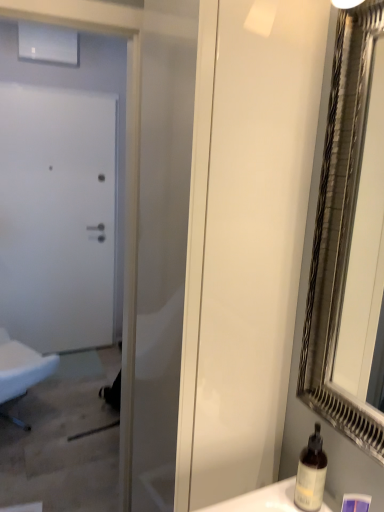
Question: Is translucent glass bottle at lower right inside the boundaries of white fabric chair at left, or outside?

Choices:
 (A) inside
 (B) outside

Answer: (B)

Question: From a real-world perspective, relative to white fabric chair at left, is translucent glass bottle at lower right vertically above or below?

Choices:
 (A) above
 (B) below

Answer: (A)

Question: Considering the real-world distances, which object is closest to the white fabric chair at left?

Choices:
 (A) white glossy screen door at center
 (B) white matte door at left
 (C) translucent glass bottle at lower right

Answer: (B)

Question: Which object is the farthest from the white fabric chair at left?

Choices:
 (A) white glossy screen door at center
 (B) translucent glass bottle at lower right
 (C) white matte door at left

Answer: (B)